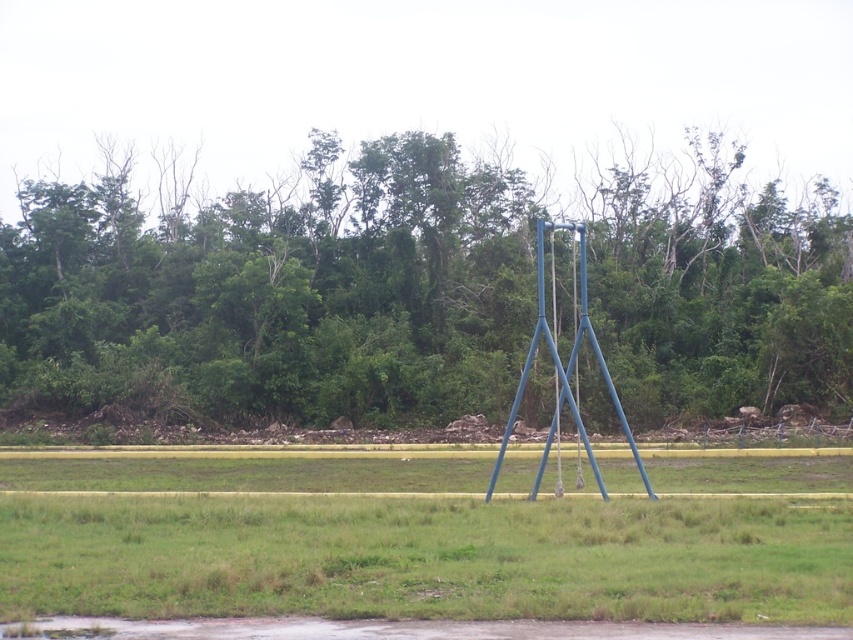
Question: Does green leafy trees at center have a lesser width compared to blue metallic swing set at center?

Choices:
 (A) no
 (B) yes

Answer: (A)

Question: Which point is closer to the camera taking this photo?

Choices:
 (A) (402, 365)
 (B) (465, 586)

Answer: (B)

Question: Observing the image, what is the correct spatial positioning of green leafy trees at center in reference to blue metallic swing set at center?

Choices:
 (A) right
 (B) left

Answer: (B)

Question: Does green leafy trees at center have a larger size compared to blue metallic swing set at center?

Choices:
 (A) no
 (B) yes

Answer: (B)